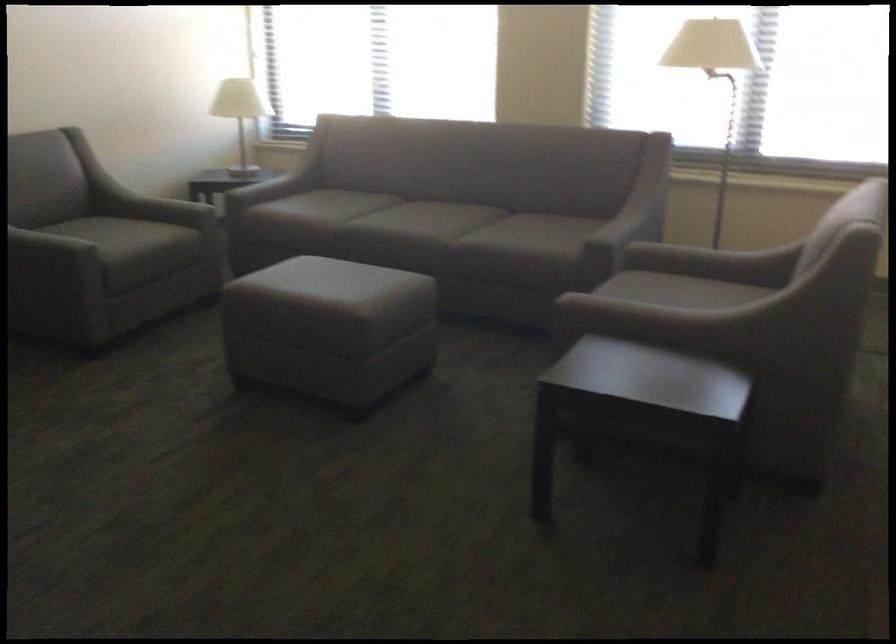
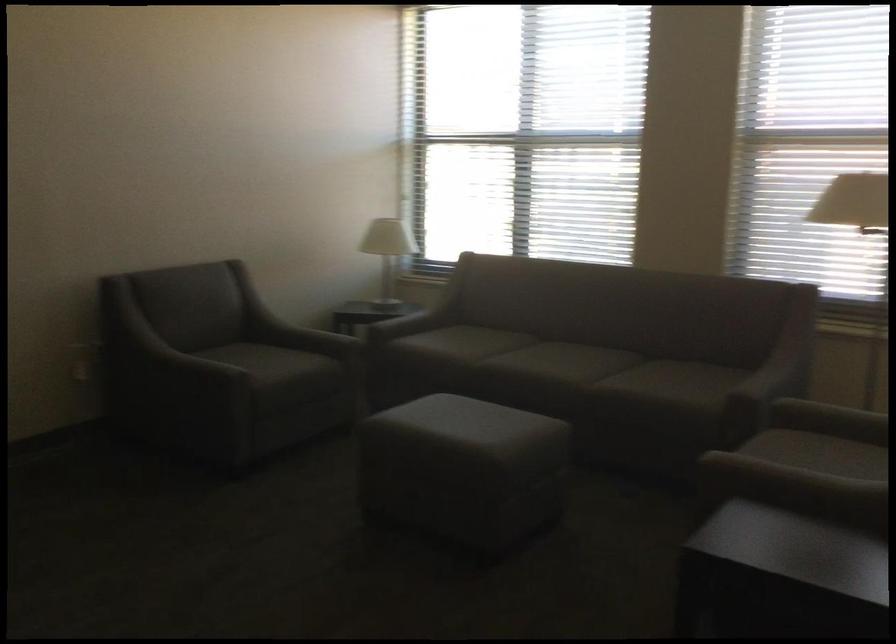
Locate, in the second image, the point that corresponds to [329,328] in the first image.

(462, 469)